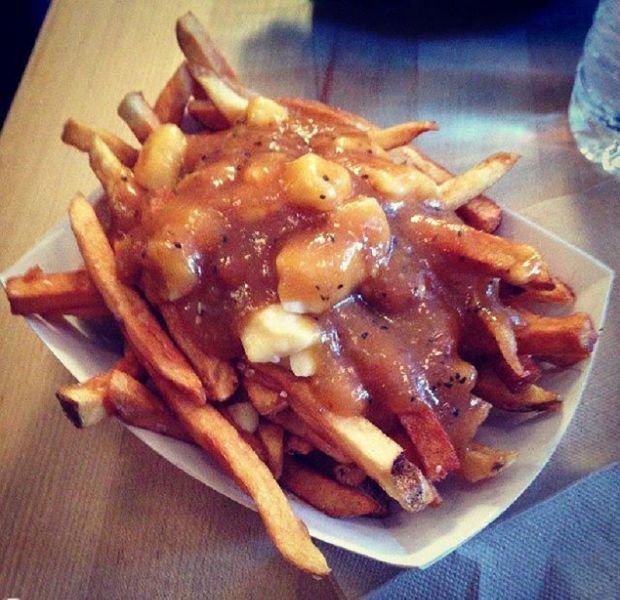
The height and width of the screenshot is (600, 620). Find the location of `shadow cast by serving container on table`. shadow cast by serving container on table is located at coordinates (95, 490).